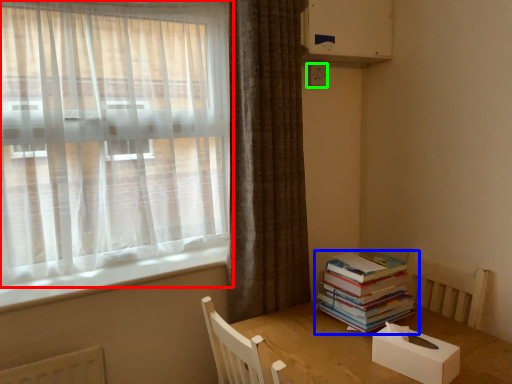
Question: Considering the real-world distances, which object is closest to curtain (highlighted by a red box)? book (highlighted by a blue box) or electric outlet (highlighted by a green box).

Choices:
 (A) book
 (B) electric outlet

Answer: (B)